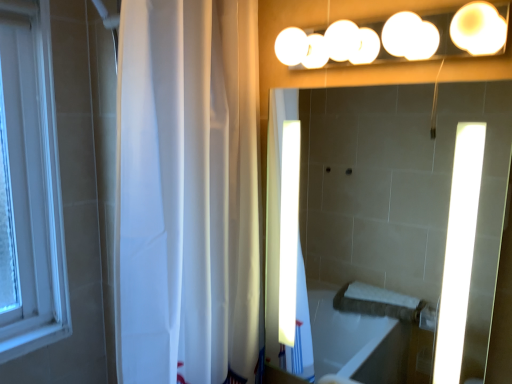
Question: Considering the relative sizes of white sheer curtain at left and white glossy mirror at upper center in the image provided, is white sheer curtain at left shorter than white glossy mirror at upper center?

Choices:
 (A) yes
 (B) no

Answer: (B)

Question: Is white sheer curtain at left closer to the viewer compared to white glossy mirror at upper center?

Choices:
 (A) yes
 (B) no

Answer: (B)

Question: Are white sheer curtain at left and white glossy mirror at upper center beside each other?

Choices:
 (A) no
 (B) yes

Answer: (A)

Question: Does white sheer curtain at left have a larger size compared to white glossy mirror at upper center?

Choices:
 (A) yes
 (B) no

Answer: (A)

Question: Can you confirm if white sheer curtain at left is thinner than white glossy mirror at upper center?

Choices:
 (A) no
 (B) yes

Answer: (A)

Question: Based on their positions, is white glossy mirror at upper center located to the left or right of white sheer curtain at left?

Choices:
 (A) right
 (B) left

Answer: (A)

Question: Considering the positions of white glossy mirror at upper center and white sheer curtain at left in the image, is white glossy mirror at upper center wider or thinner than white sheer curtain at left?

Choices:
 (A) wide
 (B) thin

Answer: (B)

Question: Relative to white sheer curtain at left, is white glossy mirror at upper center in front or behind?

Choices:
 (A) front
 (B) behind

Answer: (A)

Question: Is white glossy mirror at upper center bigger or smaller than white sheer curtain at left?

Choices:
 (A) small
 (B) big

Answer: (A)

Question: From a real-world perspective, is white sheer curtain at left physically located above or below white glossy lights at upper center?

Choices:
 (A) below
 (B) above

Answer: (A)

Question: Visually, is white sheer curtain at left positioned to the left or to the right of white glossy lights at upper center?

Choices:
 (A) left
 (B) right

Answer: (A)

Question: Looking at the image, does white sheer curtain at left seem bigger or smaller compared to white glossy lights at upper center?

Choices:
 (A) small
 (B) big

Answer: (B)

Question: Considering their positions, is white sheer curtain at left located in front of or behind white glossy lights at upper center?

Choices:
 (A) front
 (B) behind

Answer: (B)

Question: From the image's perspective, is white glossy lights at upper center located above or below white glossy mirror at upper center?

Choices:
 (A) below
 (B) above

Answer: (B)

Question: From their relative heights in the image, would you say white glossy lights at upper center is taller or shorter than white glossy mirror at upper center?

Choices:
 (A) short
 (B) tall

Answer: (A)